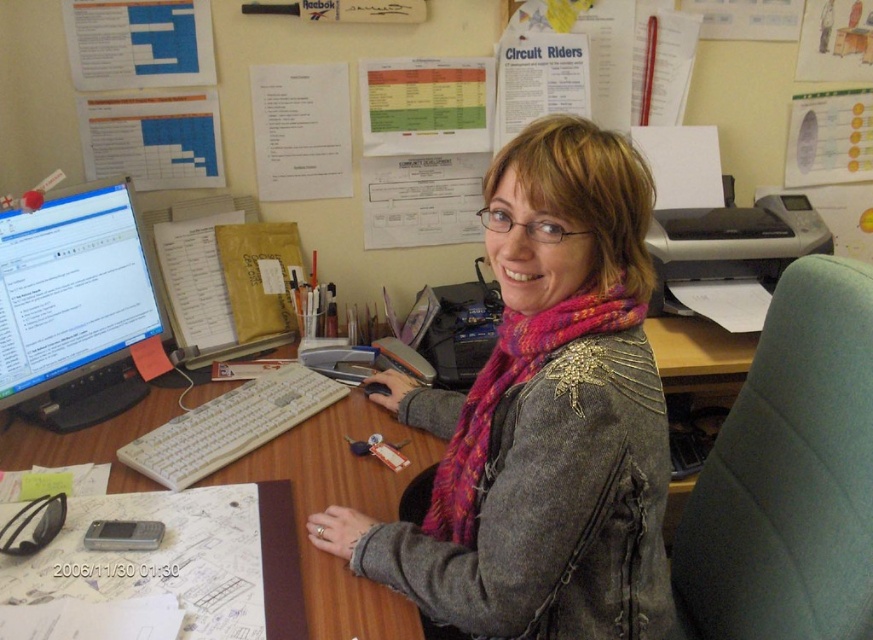
The image size is (873, 640). Describe the element at coordinates (541, 419) in the screenshot. I see `gray textured jacket at center` at that location.

Can you confirm if gray textured jacket at center is wider than wooden desk at center?

No, gray textured jacket at center is not wider than wooden desk at center.

Who is more forward, [534,618] or [314,486]?

Point [534,618] is more forward.

The height and width of the screenshot is (640, 873). I want to click on gray textured jacket at center, so click(541, 419).

In the scene shown: Is black glossy monitor at left thinner than white plastic keyboard at center?

Yes.

Looking at this image, is black glossy monitor at left to the right of white plastic keyboard at center from the viewer's perspective?

Incorrect, black glossy monitor at left is not on the right side of white plastic keyboard at center.

Is point (45, 264) farther from viewer compared to point (293, 368)?

No, (45, 264) is in front of (293, 368).

Find the location of a particular element. black glossy monitor at left is located at coordinates (74, 308).

Based on the photo, does black glossy monitor at left have a lesser width compared to pink knitted scarf at center?

Yes.

Who is taller, black glossy monitor at left or pink knitted scarf at center?

black glossy monitor at left is taller.

In order to click on black glossy monitor at left in this screenshot , I will do `click(74, 308)`.

Identify the location of black glossy monitor at left. (74, 308).